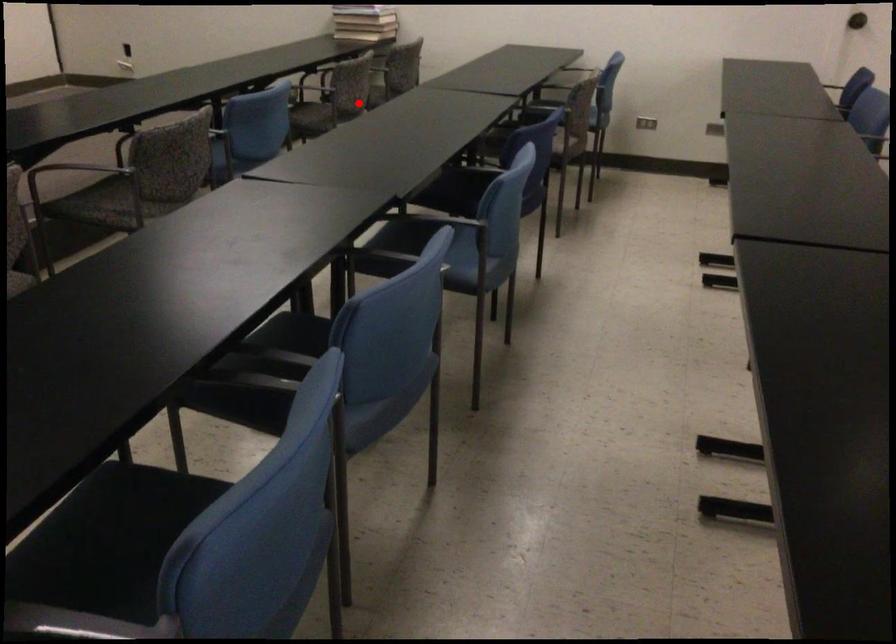
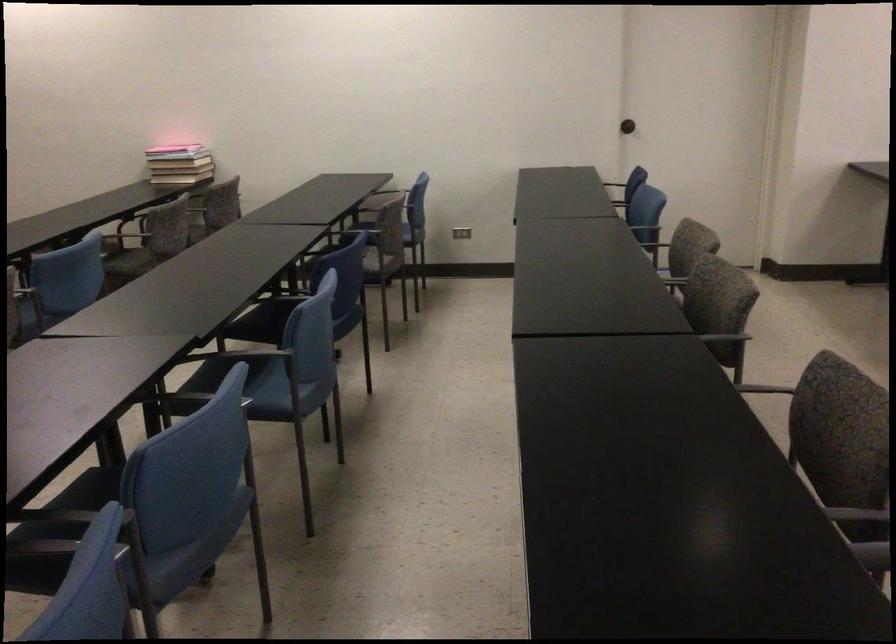
Find the pixel in the second image that matches the highlighted location in the first image.

(179, 243)